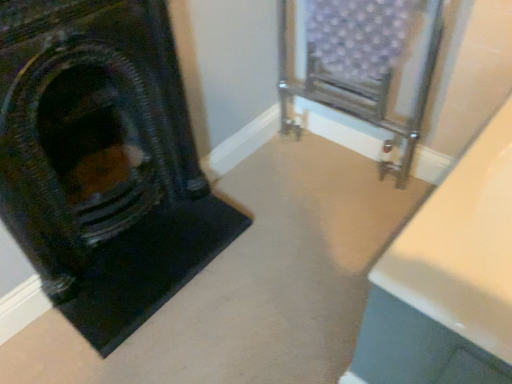
At what (x,y) coordinates should I click in order to perform the action: click on empty space that is in between matte black fireplace at left and metallic radiator at center. Please return your answer as a coordinate pair (x, y). Looking at the image, I should click on (293, 186).